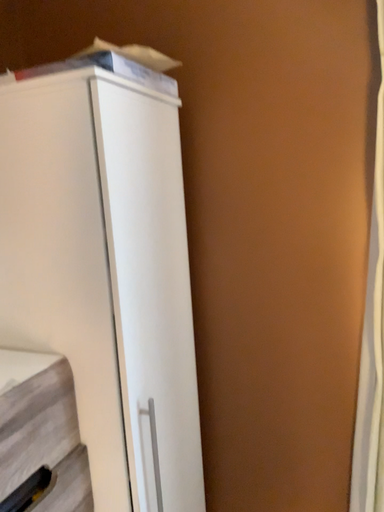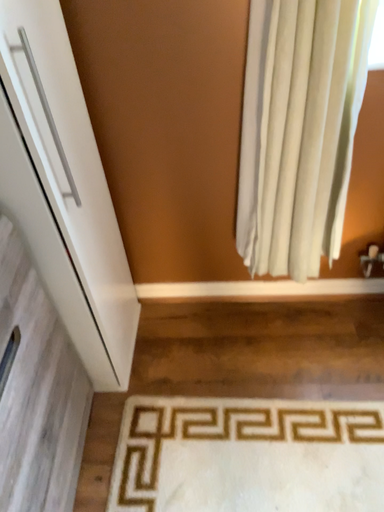
Question: Which way did the camera rotate in the video?

Choices:
 (A) rotated upward
 (B) rotated downward

Answer: (B)